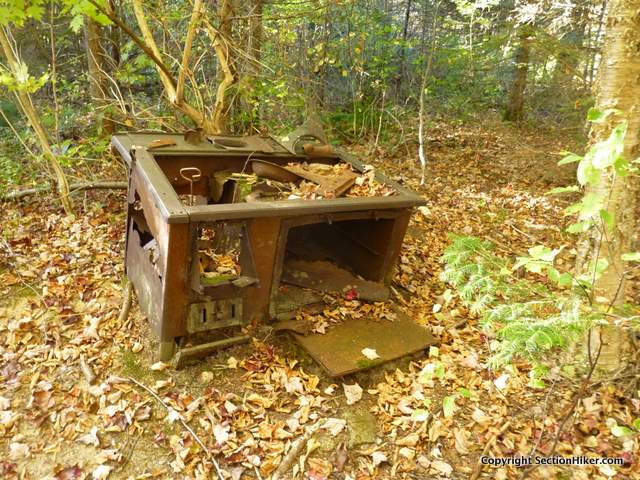
This screenshot has width=640, height=480. I want to click on oven opening, so click(369, 249).